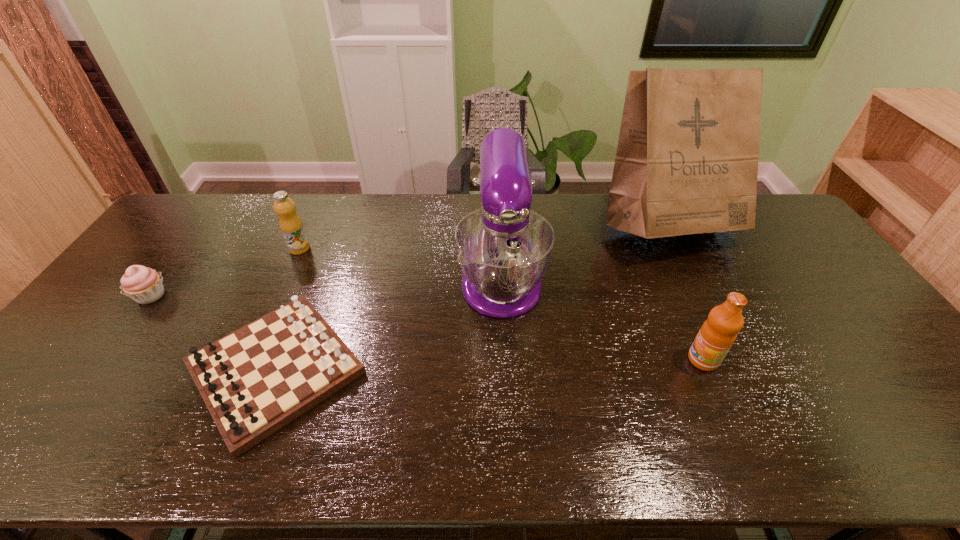
The height and width of the screenshot is (540, 960). Identify the location of unoccupied position between the cupcake and the farther fruit juice. (226, 272).

You are a GUI agent. You are given a task and a screenshot of the screen. Output one action in this format:
    pyautogui.click(x=<x>, y=<y>)
    Task: Click on the empty location between the right fruit juice and the fourth object from left to right
    
    Given the screenshot: What is the action you would take?
    pyautogui.click(x=602, y=318)

The height and width of the screenshot is (540, 960). Find the location of `free space that is in between the right fruit juice and the fifth shortest object`. free space that is in between the right fruit juice and the fifth shortest object is located at coordinates (602, 318).

Select which object appears as the closest to the right fruit juice. Please provide its 2D coordinates. Your answer should be formatted as a tuple, i.e. [(x, y)], where the tuple contains the x and y coordinates of a point satisfying the conditions above.

[(687, 156)]

Identify which object is located as the third nearest to the farther fruit juice. Please provide its 2D coordinates. Your answer should be formatted as a tuple, i.e. [(x, y)], where the tuple contains the x and y coordinates of a point satisfying the conditions above.

[(504, 248)]